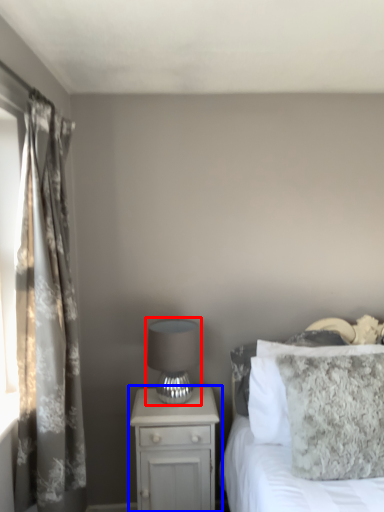
Question: Which of the following is the closest to the observer, table lamp (highlighted by a red box) or nightstand (highlighted by a blue box)?

Choices:
 (A) table lamp
 (B) nightstand

Answer: (A)